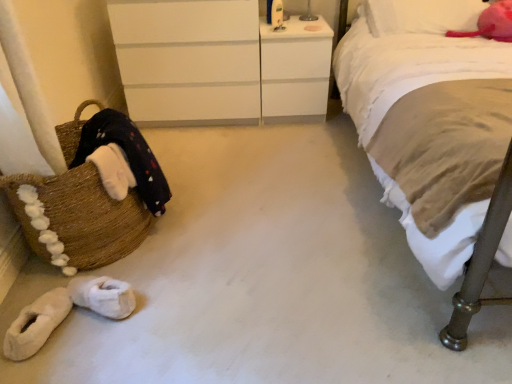
At what (x,y) coordinates should I click in order to perform the action: click on vacant space underneath white fluffy slippers at lower left, which is the second footwear in right-to-left order (from a real-world perspective). Please return your answer as a coordinate pair (x, y). The image size is (512, 384). Looking at the image, I should click on (41, 342).